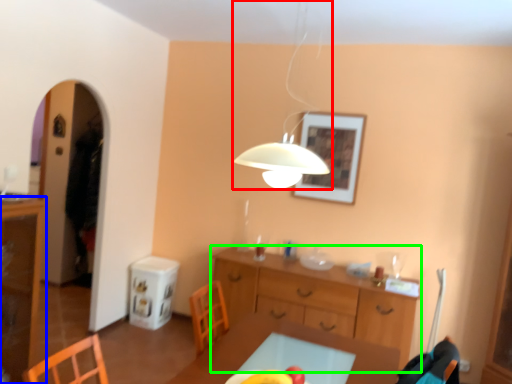
Question: Considering the real-world distances, which object is farthest from lamp (highlighted by a red box)? cabinetry (highlighted by a blue box) or desk (highlighted by a green box)?

Choices:
 (A) cabinetry
 (B) desk

Answer: (A)